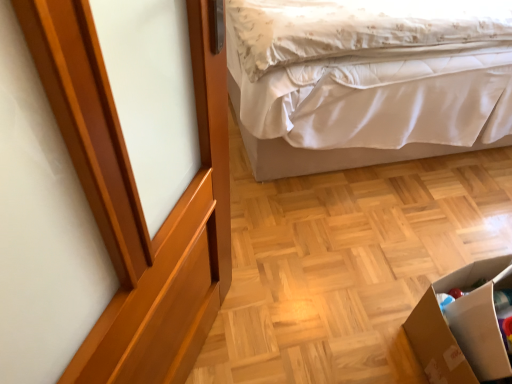
Locate an element on the screen. vacant area located to the right-hand side of glossy wood screen door at upper left is located at coordinates (288, 329).